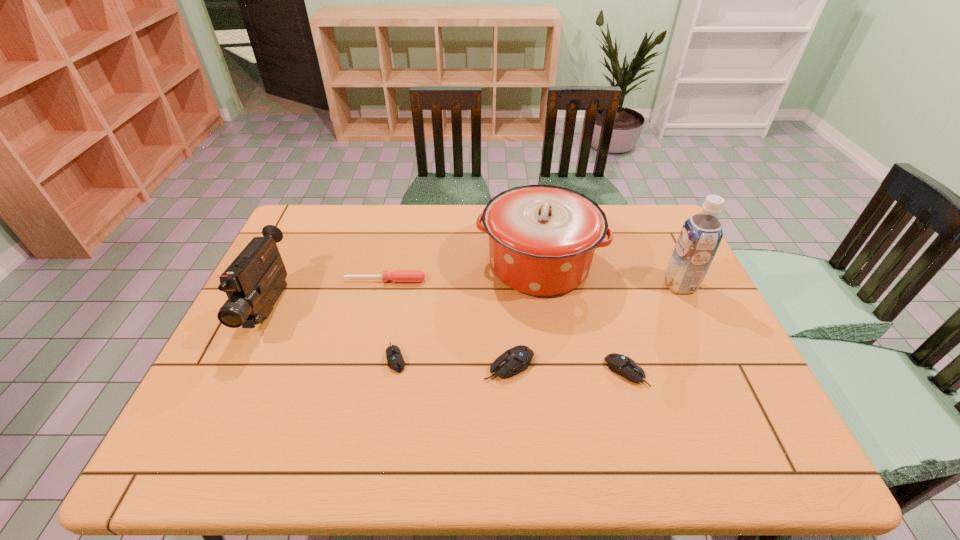
Considering the uniform spacing of computer mouses, where should an additional computer mouse be positioned on the right? Please locate a free spot. Please provide its 2D coordinates. Your answer should be formatted as a tuple, i.e. [(x, y)], where the tuple contains the x and y coordinates of a point satisfying the conditions above.

[(746, 379)]